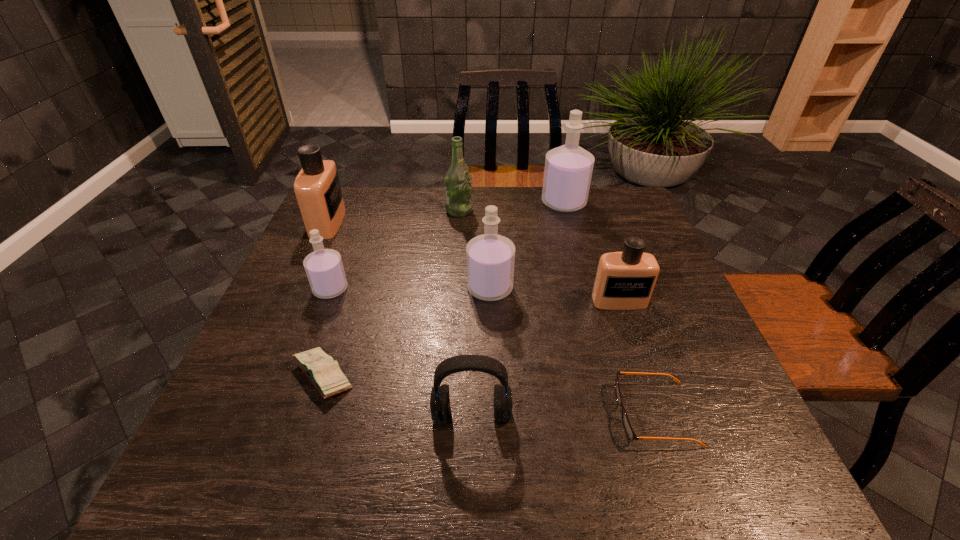
Find the location of a particular element. The height and width of the screenshot is (540, 960). the rightmost purple perfume is located at coordinates (568, 170).

Locate an element on the screen. the tallest object is located at coordinates (568, 170).

What are the coordinates of `green beer bottle` in the screenshot? It's located at (458, 191).

Identify the location of the bigger beige perfume. (317, 187).

The width and height of the screenshot is (960, 540). Find the location of `the left beige perfume`. the left beige perfume is located at coordinates (317, 187).

In order to click on the second purple perfume from right to left in this screenshot , I will do `click(490, 257)`.

Locate an element on the screen. the second smallest purple perfume is located at coordinates (490, 257).

At what (x,y) coordinates should I click in order to perform the action: click on the leftmost purple perfume. Please return your answer as a coordinate pair (x, y). The image size is (960, 540). Looking at the image, I should click on (324, 268).

The height and width of the screenshot is (540, 960). In order to click on the right beige perfume in this screenshot , I will do `click(625, 280)`.

Locate an element on the screen. the smaller beige perfume is located at coordinates (625, 280).